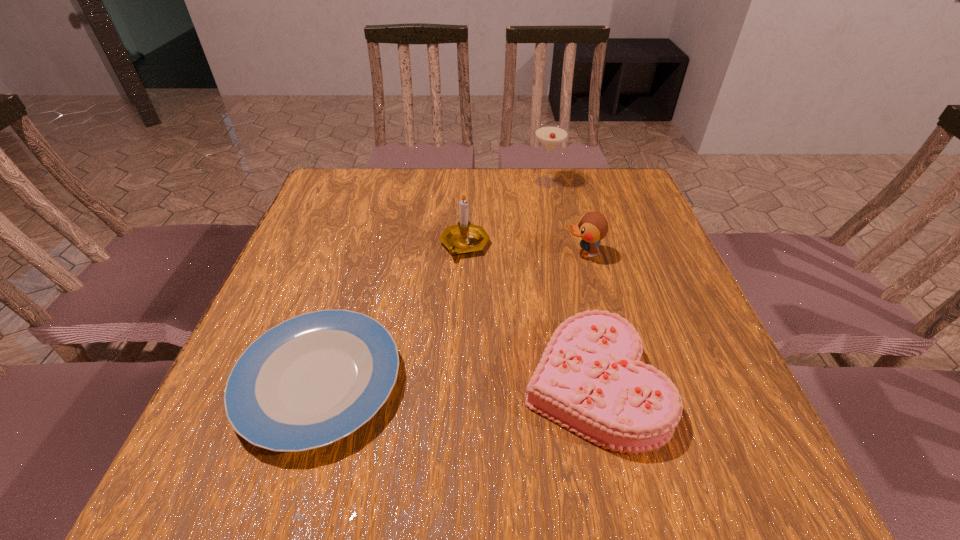
Where is `free space located 0.200m on the front-facing side of the duck`? The width and height of the screenshot is (960, 540). free space located 0.200m on the front-facing side of the duck is located at coordinates (480, 254).

Image resolution: width=960 pixels, height=540 pixels. I want to click on vacant area located 0.100m on the left of the cake, so click(x=467, y=384).

This screenshot has width=960, height=540. I want to click on vacant space located 0.250m on the right of the leftmost object, so click(x=541, y=382).

The image size is (960, 540). Identify the location of object that is at the far edge. (550, 136).

At what (x,y) coordinates should I click in order to perform the action: click on cake that is at the near edge. Please return your answer as a coordinate pair (x, y). Looking at the image, I should click on (590, 379).

Locate an element on the screen. Image resolution: width=960 pixels, height=540 pixels. plate at the near edge is located at coordinates (316, 378).

Where is `object located in the left edge section of the desktop`? The width and height of the screenshot is (960, 540). object located in the left edge section of the desktop is located at coordinates (316, 378).

This screenshot has height=540, width=960. Identify the location of duck located at the right edge. (592, 227).

Find the location of a particular element. cake situated at the right edge is located at coordinates (590, 379).

Identify the location of object situated at the near left corner. (316, 378).